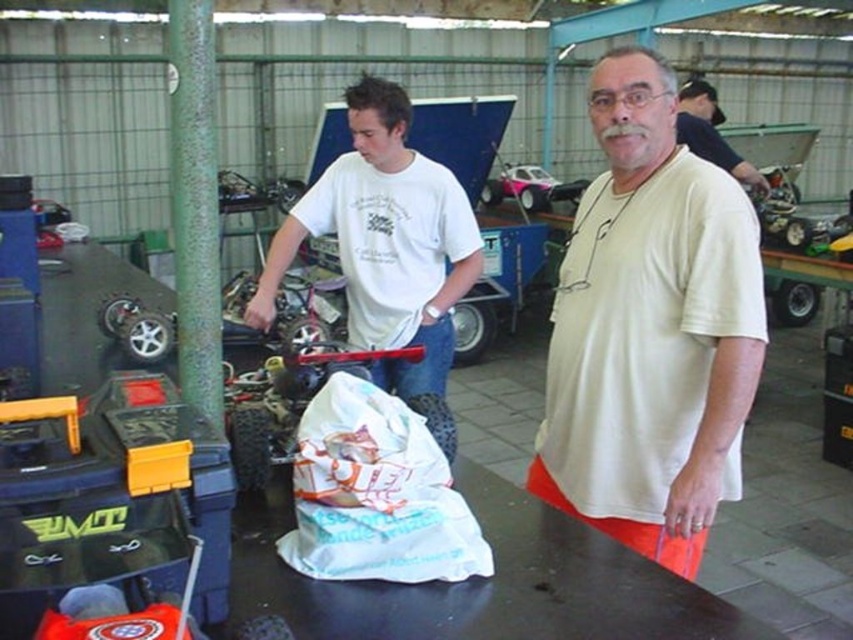
Question: Does white paper bag at center appear over dark blue shirt at upper right?

Choices:
 (A) yes
 (B) no

Answer: (B)

Question: Can you confirm if white matte t-shirt at center is positioned to the right of dark blue shirt at upper right?

Choices:
 (A) yes
 (B) no

Answer: (B)

Question: Among these points, which one is farthest from the camera?

Choices:
 (A) (296, 515)
 (B) (637, 524)

Answer: (B)

Question: Which point is farther to the camera?

Choices:
 (A) white paper bag at center
 (B) white matte t-shirt at center
 (C) dark blue shirt at upper right

Answer: (C)

Question: Is white cotton t-shirt at center positioned behind dark blue shirt at upper right?

Choices:
 (A) yes
 (B) no

Answer: (B)

Question: Which object is positioned closest to the dark blue shirt at upper right?

Choices:
 (A) white cotton t-shirt at center
 (B) white paper bag at center
 (C) white matte t-shirt at center

Answer: (A)